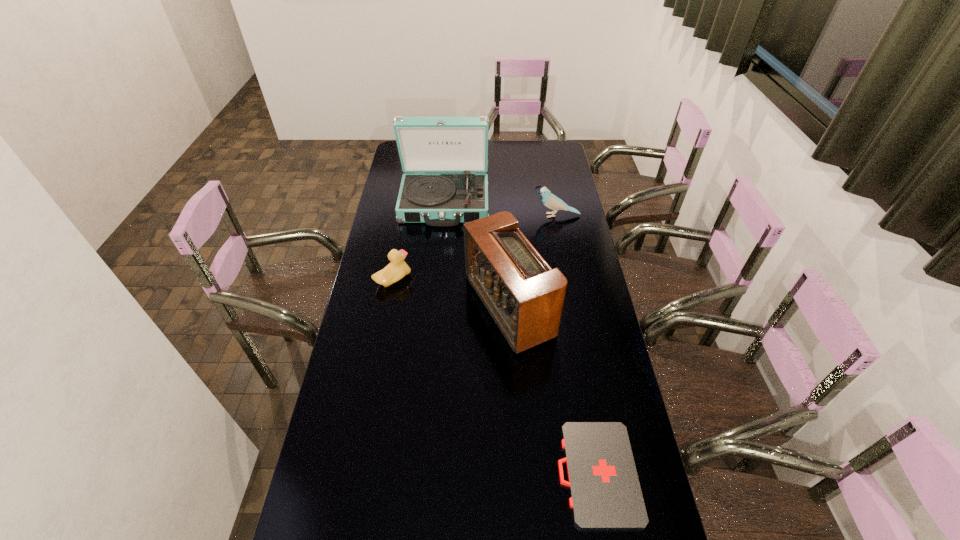
Locate which object ranks fourth in proximity to the record player. Please provide its 2D coordinates. Your answer should be formatted as a tuple, i.e. [(x, y)], where the tuple contains the x and y coordinates of a point satisfying the conditions above.

[(605, 492)]

Where is `vacant region that satisfies the following two spatial constraints: 1. at the beak of the fourth tallest object; 2. on the right side of the second tallest object`? This screenshot has height=540, width=960. vacant region that satisfies the following two spatial constraints: 1. at the beak of the fourth tallest object; 2. on the right side of the second tallest object is located at coordinates (388, 307).

At what (x,y) coordinates should I click in order to perform the action: click on vacant area in the image that satisfies the following two spatial constraints: 1. on the face side of the tallest object; 2. at the beak of the fourth tallest object. Please return your answer as a coordinate pair (x, y). The image size is (960, 540). Looking at the image, I should click on (438, 280).

The image size is (960, 540). Find the location of `blank area in the image that satisfies the following two spatial constraints: 1. at the beak of the radio receiver; 2. on the right side of the duck`. blank area in the image that satisfies the following two spatial constraints: 1. at the beak of the radio receiver; 2. on the right side of the duck is located at coordinates (388, 307).

Locate an element on the screen. This screenshot has width=960, height=540. free spot that satisfies the following two spatial constraints: 1. on the back side of the fourth shortest object; 2. at the beak of the duck is located at coordinates (507, 280).